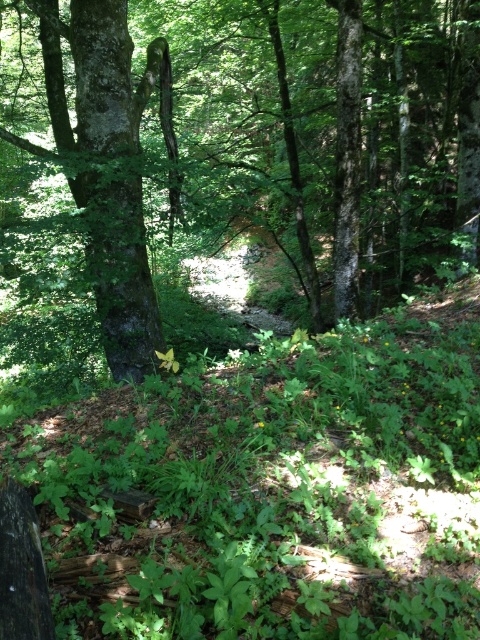
Which is behind, point (368, 35) or point (123, 294)?

The point (368, 35) is behind.

Is point (92, 228) farther from camera compared to point (136, 266)?

No, it is not.

Is point (118, 253) positioned behind point (132, 316)?

No, it is in front of (132, 316).

Locate an element on the screen. green rough bark tree at center is located at coordinates (244, 150).